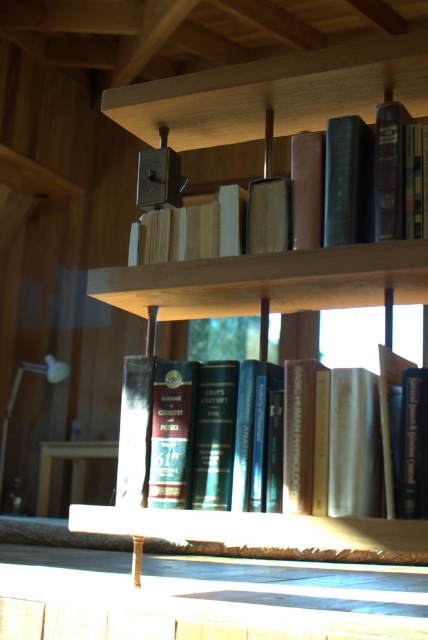
Can you confirm if wooden bookcase at center is positioned above hardcover books at center?

Correct, wooden bookcase at center is located above hardcover books at center.

Who is lower down, wooden bookcase at center or hardcover books at center?

hardcover books at center is below.

You are a GUI agent. You are given a task and a screenshot of the screen. Output one action in this format:
    pyautogui.click(x=<x>, y=<y>)
    Task: Click on the wooden bookcase at center
    This screenshot has height=640, width=428.
    Given the screenshot: What is the action you would take?
    pyautogui.click(x=275, y=93)

Which is more to the right, wooden bookcase at center or hardcover book at upper center?

wooden bookcase at center is more to the right.

Is wooden bookcase at center shorter than hardcover book at upper center?

Indeed, wooden bookcase at center has a lesser height compared to hardcover book at upper center.

Between point (300, 298) and point (267, 129), which one is positioned in front?

Positioned in front is point (300, 298).

Locate an element on the screen. wooden bookcase at center is located at coordinates (275, 93).

Measure the distance between hardcover books at center and camera.

A distance of 4.02 feet exists between hardcover books at center and camera.

Which is more to the right, hardcover books at center or hardcover book at upper center?

hardcover books at center

Is point (163, 502) positioned before point (166, 212)?

Yes, point (163, 502) is in front of point (166, 212).

Identify the location of hardcover books at center. The image size is (428, 640). (137, 426).